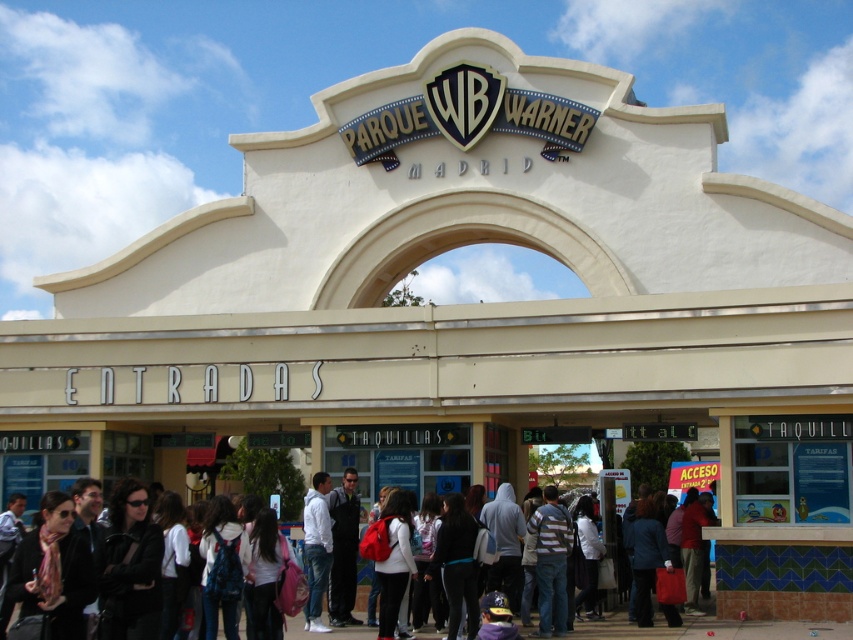
You are a visitor at Parque Warner Madrid and you see a person wearing a white matte jacket at center and a white cotton shirt at center. Which clothing item is on the left side?

The white matte jacket at center is positioned on the left side of the white cotton shirt at center.

You are a visitor standing at the entrance of Parque Warner Madrid and see both the dark gray fabric jacket at center and the white matte jacket at center. You need to reach the ticket booth labeled TAQUILLAS, which is 4 meters away from your current position. Can you comfortably walk between the two jackets to get to the ticket booth without needing to go around them?

The dark gray fabric jacket at center is 3.37 meters away from the white matte jacket at center. Since the distance between them is less than the 4 meters to the ticket booth, you can comfortably walk between them to reach the TAQUILLAS ticket booth.

Based on the photo, you are a visitor at Parque Warner Madrid and see two jackets hanging on a coat rack near the entrance. The jackets are the dark gray fabric jacket at center and the white matte jacket at center. Which jacket is on top?

The white matte jacket at center is on top because the dark gray fabric jacket at center is positioned under it.